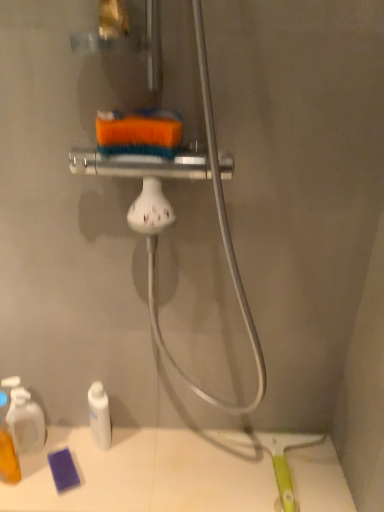
Where is `purple sponge at lower left`? purple sponge at lower left is located at coordinates (149, 473).

What do you see at coordinates (24, 418) in the screenshot?
I see `translucent plastic spray bottle at lower left, arranged as the second toiletry when viewed from the left` at bounding box center [24, 418].

You are a GUI agent. You are given a task and a screenshot of the screen. Output one action in this format:
    pyautogui.click(x=<x>, y=<y>)
    Task: Click on the translucent plastic spray bottle at lower left, arranged as the second toiletry when viewed from the left
    Image resolution: width=384 pixels, height=512 pixels.
    Given the screenshot: What is the action you would take?
    pyautogui.click(x=24, y=418)

What do you see at coordinates (99, 415) in the screenshot? I see `white matte bottle at lower left, which is the 3th toiletry from left to right` at bounding box center [99, 415].

Where is `translucent plastic bottle at lower left, placed as the third toiletry when sorted from right to left`? This screenshot has width=384, height=512. translucent plastic bottle at lower left, placed as the third toiletry when sorted from right to left is located at coordinates (7, 448).

Who is bigger, translucent plastic bottle at lower left, placed as the third toiletry when sorted from right to left, or translucent plastic spray bottle at lower left, placed as the second toiletry when sorted from right to left?

translucent plastic bottle at lower left, placed as the third toiletry when sorted from right to left.

Which object is further away from the camera, translucent plastic bottle at lower left, placed as the first toiletry when sorted from left to right, or translucent plastic spray bottle at lower left, arranged as the second toiletry when viewed from the left?

translucent plastic spray bottle at lower left, arranged as the second toiletry when viewed from the left, is further from the camera.

Is translucent plastic bottle at lower left, placed as the third toiletry when sorted from right to left, inside or outside of translucent plastic spray bottle at lower left, placed as the second toiletry when sorted from right to left?

translucent plastic bottle at lower left, placed as the third toiletry when sorted from right to left, is spatially situated outside translucent plastic spray bottle at lower left, placed as the second toiletry when sorted from right to left.

Is translucent plastic bottle at lower left, placed as the first toiletry when sorted from left to right, oriented away from translucent plastic spray bottle at lower left, arranged as the second toiletry when viewed from the left?

Yes, translucent plastic bottle at lower left, placed as the first toiletry when sorted from left to right,'s orientation is away from translucent plastic spray bottle at lower left, arranged as the second toiletry when viewed from the left.

In the image, is white matte bottle at lower left, which is the 3th toiletry from left to right, positioned in front of or behind translucent plastic spray bottle at lower left, placed as the second toiletry when sorted from right to left?

Visually, white matte bottle at lower left, which is the 3th toiletry from left to right, is located behind translucent plastic spray bottle at lower left, placed as the second toiletry when sorted from right to left.

The height and width of the screenshot is (512, 384). I want to click on toiletry behind the translucent plastic spray bottle at lower left, arranged as the second toiletry when viewed from the left, so click(x=99, y=415).

Choose the correct answer: Is white matte bottle at lower left, which is the 3th toiletry from left to right, inside translucent plastic spray bottle at lower left, arranged as the second toiletry when viewed from the left, or outside it?

white matte bottle at lower left, which is the 3th toiletry from left to right, is outside translucent plastic spray bottle at lower left, arranged as the second toiletry when viewed from the left.

How distant is white matte bottle at lower left, which is the 3th toiletry from left to right, from translucent plastic spray bottle at lower left, placed as the second toiletry when sorted from right to left?

white matte bottle at lower left, which is the 3th toiletry from left to right, and translucent plastic spray bottle at lower left, placed as the second toiletry when sorted from right to left, are 5.79 inches apart.

How many degrees apart are the facing directions of translucent plastic bottle at lower left, placed as the third toiletry when sorted from right to left, and white matte bottle at lower left, which is the 3th toiletry from left to right?

The angular difference between translucent plastic bottle at lower left, placed as the third toiletry when sorted from right to left, and white matte bottle at lower left, which is the 3th toiletry from left to right, is 31.2 degrees.

Who is shorter, translucent plastic bottle at lower left, placed as the first toiletry when sorted from left to right, or white matte bottle at lower left, which is the 3th toiletry from left to right?

white matte bottle at lower left, which is the 3th toiletry from left to right, is shorter.

From the image's perspective, which one is positioned lower, translucent plastic bottle at lower left, placed as the third toiletry when sorted from right to left, or white matte bottle at lower left, which is the 3th toiletry from left to right?

translucent plastic bottle at lower left, placed as the third toiletry when sorted from right to left, from the image's perspective.

Measure the distance between translucent plastic bottle at lower left, placed as the third toiletry when sorted from right to left, and white matte bottle at lower left, which is the 3th toiletry from left to right.

translucent plastic bottle at lower left, placed as the third toiletry when sorted from right to left, is 7.77 inches away from white matte bottle at lower left, which is the 3th toiletry from left to right.

Looking at their sizes, would you say purple sponge at lower left is wider or thinner than translucent plastic spray bottle at lower left, arranged as the second toiletry when viewed from the left?

Clearly, purple sponge at lower left has more width compared to translucent plastic spray bottle at lower left, arranged as the second toiletry when viewed from the left.

Is purple sponge at lower left oriented away from translucent plastic spray bottle at lower left, placed as the second toiletry when sorted from right to left?

purple sponge at lower left does not have its back to translucent plastic spray bottle at lower left, placed as the second toiletry when sorted from right to left.

Is purple sponge at lower left next to translucent plastic spray bottle at lower left, arranged as the second toiletry when viewed from the left, and touching it?

purple sponge at lower left is not next to translucent plastic spray bottle at lower left, arranged as the second toiletry when viewed from the left, and they're not touching.

Is purple sponge at lower left located outside translucent plastic spray bottle at lower left, placed as the second toiletry when sorted from right to left?

Yes.

Can you confirm if white matte bottle at lower left, which is the 3th toiletry from left to right, is positioned to the left of purple sponge at lower left?

Yes.

Between white matte bottle at lower left, which is the 3th toiletry from left to right, and purple sponge at lower left, which one has smaller width?

Thinner between the two is white matte bottle at lower left, which is the 3th toiletry from left to right.

Does white matte bottle at lower left, which is the 3th toiletry from left to right, have a larger size compared to purple sponge at lower left?

No, white matte bottle at lower left, which is the 3th toiletry from left to right, is not bigger than purple sponge at lower left.

Does white matte bottle at lower left, the 1th toiletry positioned from the right, touch purple sponge at lower left?

There is a gap between white matte bottle at lower left, the 1th toiletry positioned from the right, and purple sponge at lower left.

Is purple sponge at lower left oriented away from translucent plastic bottle at lower left, placed as the first toiletry when sorted from left to right?

That's not correct — purple sponge at lower left is not looking away from translucent plastic bottle at lower left, placed as the first toiletry when sorted from left to right.

Considering the sizes of objects purple sponge at lower left and translucent plastic bottle at lower left, placed as the third toiletry when sorted from right to left, in the image provided, who is shorter, purple sponge at lower left or translucent plastic bottle at lower left, placed as the third toiletry when sorted from right to left,?

Standing shorter between the two is purple sponge at lower left.

Choose the correct answer: Is purple sponge at lower left inside translucent plastic bottle at lower left, placed as the third toiletry when sorted from right to left, or outside it?

purple sponge at lower left is not inside translucent plastic bottle at lower left, placed as the third toiletry when sorted from right to left, it's outside.

Consider the image. Which of these two, purple sponge at lower left or translucent plastic bottle at lower left, placed as the first toiletry when sorted from left to right, is wider?

purple sponge at lower left.

Considering the sizes of objects translucent plastic bottle at lower left, placed as the first toiletry when sorted from left to right, and purple sponge at lower left in the image provided, who is smaller, translucent plastic bottle at lower left, placed as the first toiletry when sorted from left to right, or purple sponge at lower left?

translucent plastic bottle at lower left, placed as the first toiletry when sorted from left to right, is smaller.

Is translucent plastic bottle at lower left, placed as the first toiletry when sorted from left to right, not near purple sponge at lower left?

Answer: No.

In the scene shown: Between translucent plastic bottle at lower left, placed as the third toiletry when sorted from right to left, and purple sponge at lower left, which one appears on the left side from the viewer's perspective?

Answer: Positioned to the left is translucent plastic bottle at lower left, placed as the third toiletry when sorted from right to left.

The image size is (384, 512). Identify the location of counter lying below the translucent plastic bottle at lower left, placed as the third toiletry when sorted from right to left (from the image's perspective). (149, 473).

I want to click on toiletry below the translucent plastic spray bottle at lower left, arranged as the second toiletry when viewed from the left (from the image's perspective), so click(x=7, y=448).

In order to click on the 1st toiletry to the left of the white matte bottle at lower left, the 1th toiletry positioned from the right, counting from the anchor's position in this screenshot , I will do `click(24, 418)`.

Estimate the real-world distances between objects in this image. Which object is further from purple sponge at lower left, white matte bottle at lower left, the 1th toiletry positioned from the right, or translucent plastic spray bottle at lower left, placed as the second toiletry when sorted from right to left?

The object further to purple sponge at lower left is translucent plastic spray bottle at lower left, placed as the second toiletry when sorted from right to left.

Looking at the image, which one is located closer to translucent plastic bottle at lower left, placed as the third toiletry when sorted from right to left, white matte bottle at lower left, which is the 3th toiletry from left to right, or translucent plastic spray bottle at lower left, arranged as the second toiletry when viewed from the left?

The object closer to translucent plastic bottle at lower left, placed as the third toiletry when sorted from right to left, is translucent plastic spray bottle at lower left, arranged as the second toiletry when viewed from the left.

From the image, which object appears to be farther from translucent plastic bottle at lower left, placed as the third toiletry when sorted from right to left, translucent plastic spray bottle at lower left, placed as the second toiletry when sorted from right to left, or white matte bottle at lower left, which is the 3th toiletry from left to right?

The object further to translucent plastic bottle at lower left, placed as the third toiletry when sorted from right to left, is white matte bottle at lower left, which is the 3th toiletry from left to right.

When comparing their distances from translucent plastic spray bottle at lower left, arranged as the second toiletry when viewed from the left, does translucent plastic bottle at lower left, placed as the third toiletry when sorted from right to left, or purple sponge at lower left seem further?

purple sponge at lower left lies further to translucent plastic spray bottle at lower left, arranged as the second toiletry when viewed from the left, than the other object.

Estimate the real-world distances between objects in this image. Which object is further from translucent plastic spray bottle at lower left, placed as the second toiletry when sorted from right to left, purple sponge at lower left or white matte bottle at lower left, which is the 3th toiletry from left to right?

purple sponge at lower left is positioned further to the anchor translucent plastic spray bottle at lower left, placed as the second toiletry when sorted from right to left.

Based on their spatial positions, is translucent plastic spray bottle at lower left, arranged as the second toiletry when viewed from the left, or purple sponge at lower left further from translucent plastic bottle at lower left, placed as the first toiletry when sorted from left to right?

Based on the image, purple sponge at lower left appears to be further to translucent plastic bottle at lower left, placed as the first toiletry when sorted from left to right.

Looking at the image, which one is located closer to translucent plastic spray bottle at lower left, arranged as the second toiletry when viewed from the left, white matte bottle at lower left, the 1th toiletry positioned from the right, or purple sponge at lower left?

white matte bottle at lower left, the 1th toiletry positioned from the right, is closer to translucent plastic spray bottle at lower left, arranged as the second toiletry when viewed from the left.

Consider the image. Based on their spatial positions, is white matte bottle at lower left, the 1th toiletry positioned from the right, or purple sponge at lower left further from translucent plastic bottle at lower left, placed as the first toiletry when sorted from left to right?

Based on the image, purple sponge at lower left appears to be further to translucent plastic bottle at lower left, placed as the first toiletry when sorted from left to right.

Image resolution: width=384 pixels, height=512 pixels. In order to click on toiletry between translucent plastic bottle at lower left, placed as the third toiletry when sorted from right to left, and white matte bottle at lower left, which is the 3th toiletry from left to right, from left to right in this screenshot , I will do `click(24, 418)`.

Where is `toiletry between translucent plastic spray bottle at lower left, arranged as the second toiletry when viewed from the left, and purple sponge at lower left, in the horizontal direction`? The width and height of the screenshot is (384, 512). toiletry between translucent plastic spray bottle at lower left, arranged as the second toiletry when viewed from the left, and purple sponge at lower left, in the horizontal direction is located at coordinates (99, 415).